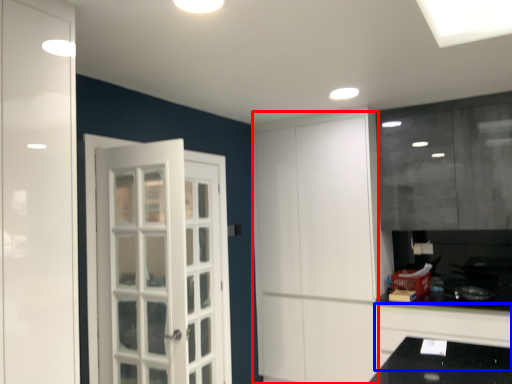
Question: Which object is closer to the camera taking this photo, door (highlighted by a red box) or cabinetry (highlighted by a blue box)?

Choices:
 (A) door
 (B) cabinetry

Answer: (B)